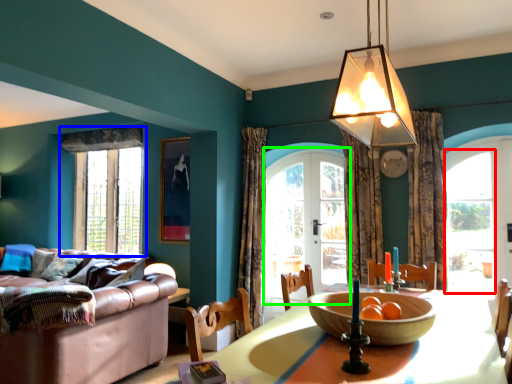
Question: Which object is the closest to the window (highlighted by a red box)? Choose among these: window (highlighted by a blue box) or screen door (highlighted by a green box).

Choices:
 (A) window
 (B) screen door

Answer: (B)